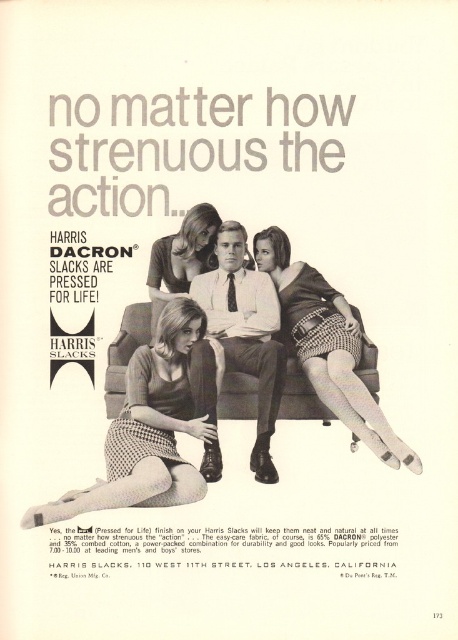
You are standing at the entrance of the advertisement scene. The brown leather couch at center is where the man is sitting. If you want to approach the couch from the entrance, which direction should you move relative to the couch?

Since the brown leather couch at center is located at point coordinates, you would need to move towards the center area of the scene to reach it from the entrance. However, without specific spatial relationships provided in the Objects Description beyond its coordinates, the exact direction cannot be determined beyond knowing it is at the center.

In the scene shown: In the vintage Harris Dacron Slacks advertisement, there is a checkered fabric skirt at center and a matte black dress at center. From the perspective of an observer looking at the ad, which of these two items is positioned higher on the image?

The checkered fabric skirt at center is taller than the matte black dress at center, so it is positioned higher in the image.